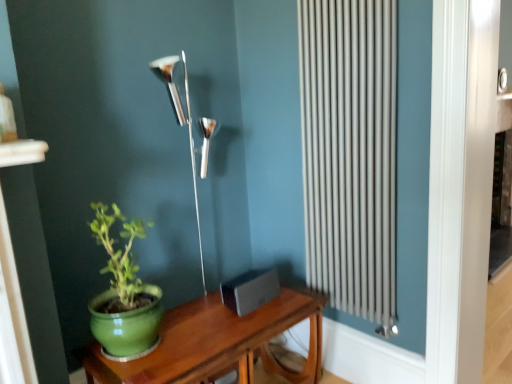
Question: Can you confirm if silver metallic radiator at right is positioned to the right of green wood table at lower left?

Choices:
 (A) yes
 (B) no

Answer: (A)

Question: Is silver metallic radiator at right further to the viewer compared to green wood table at lower left?

Choices:
 (A) no
 (B) yes

Answer: (B)

Question: Is silver metallic radiator at right positioned before green wood table at lower left?

Choices:
 (A) no
 (B) yes

Answer: (A)

Question: Considering the relative sizes of silver metallic radiator at right and green wood table at lower left in the image provided, is silver metallic radiator at right wider than green wood table at lower left?

Choices:
 (A) yes
 (B) no

Answer: (B)

Question: From a real-world perspective, is silver metallic radiator at right below green wood table at lower left?

Choices:
 (A) yes
 (B) no

Answer: (B)

Question: Is there a large distance between silver metallic radiator at right and green wood table at lower left?

Choices:
 (A) yes
 (B) no

Answer: (B)

Question: Are green matte pot at left and silver metallic radiator at right making contact?

Choices:
 (A) yes
 (B) no

Answer: (B)

Question: Is green matte pot at left positioned behind silver metallic radiator at right?

Choices:
 (A) yes
 (B) no

Answer: (B)

Question: From the image's perspective, is green matte pot at left located beneath silver metallic radiator at right?

Choices:
 (A) yes
 (B) no

Answer: (A)

Question: Is green matte pot at left thinner than silver metallic radiator at right?

Choices:
 (A) no
 (B) yes

Answer: (A)

Question: Would you say green matte pot at left is a long distance from silver metallic radiator at right?

Choices:
 (A) yes
 (B) no

Answer: (B)

Question: Is green matte pot at left to the right of silver metallic radiator at right from the viewer's perspective?

Choices:
 (A) no
 (B) yes

Answer: (A)

Question: Is green matte pot at left oriented away from polished silver lamp at center?

Choices:
 (A) yes
 (B) no

Answer: (B)